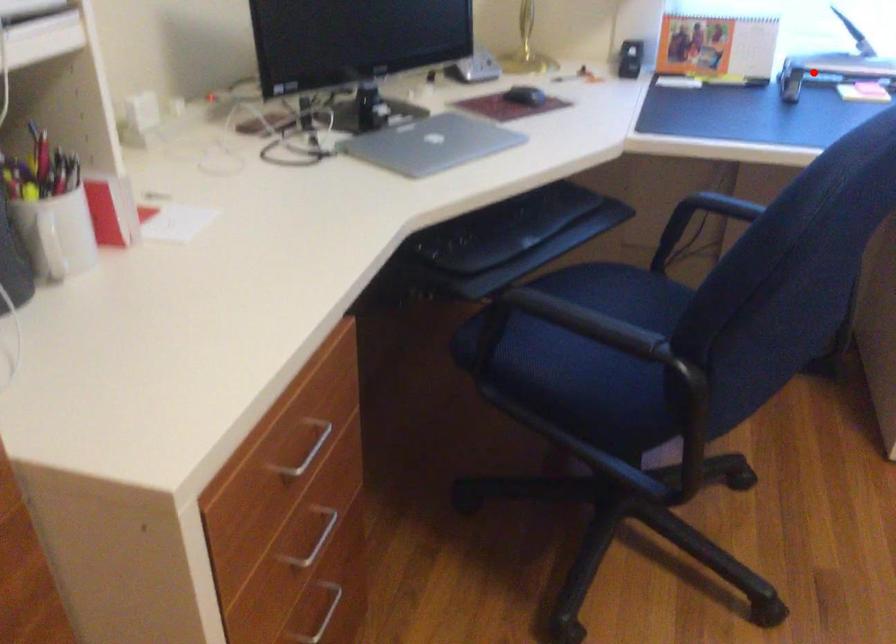
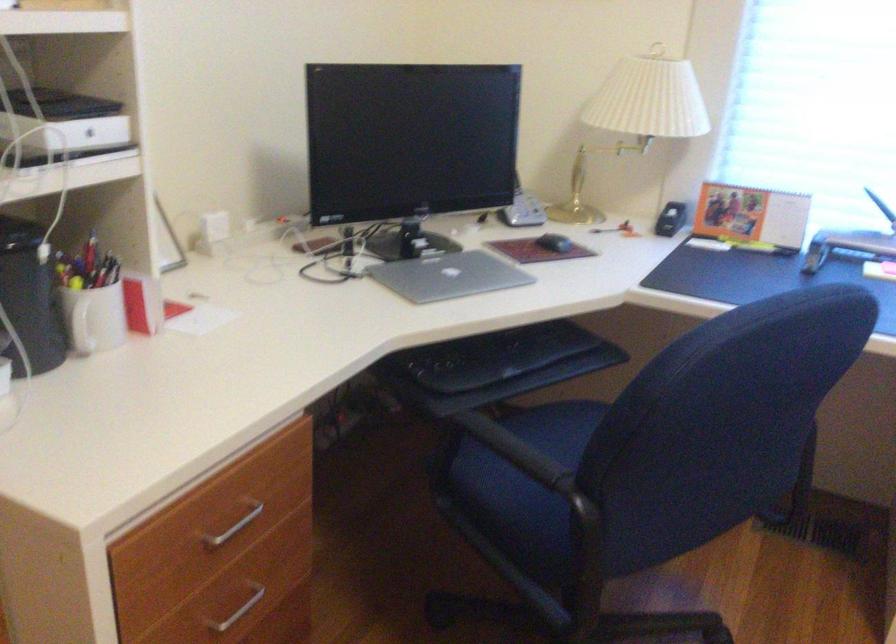
Where in the second image is the point corresponding to the highlighted location from the first image?

(847, 245)